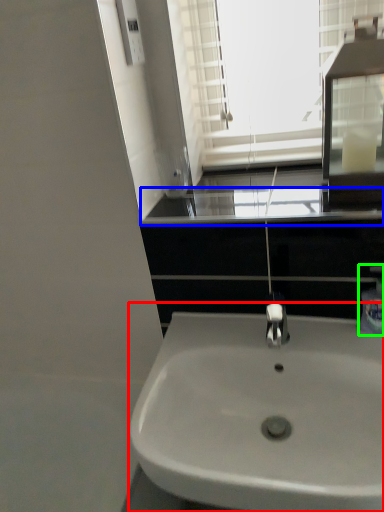
Question: Considering the real-world distances, which object is farthest from sink (highlighted by a red box)? window sill (highlighted by a blue box) or soap dispenser (highlighted by a green box)?

Choices:
 (A) window sill
 (B) soap dispenser

Answer: (A)